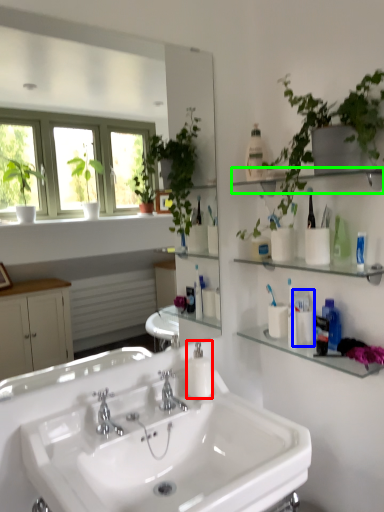
Question: Based on their relative distances, which object is farther from soap dispenser (highlighted by a red box)? Choose from toiletry (highlighted by a blue box) and shelf (highlighted by a green box).

Choices:
 (A) toiletry
 (B) shelf

Answer: (B)